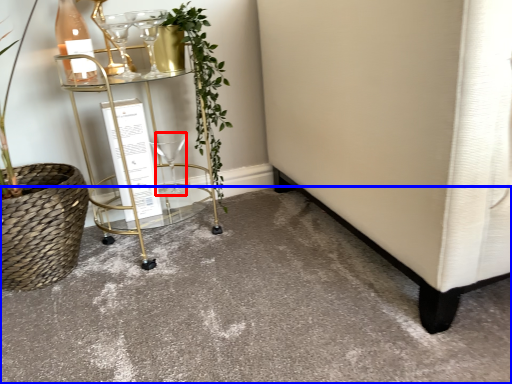
Question: Which object is closer to the camera taking this photo, wine glass (highlighted by a red box) or concrete (highlighted by a blue box)?

Choices:
 (A) wine glass
 (B) concrete

Answer: (B)